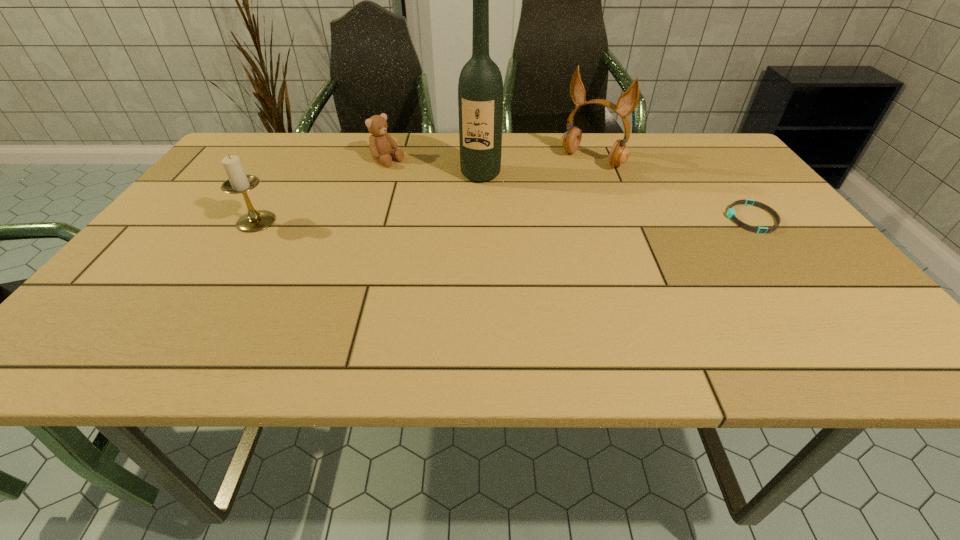
Identify the location of free space on the desktop that is between the candle holder and the wristband and is positioned on the face of the fourth tallest object. The height and width of the screenshot is (540, 960). (497, 220).

Locate an element on the screen. This screenshot has width=960, height=540. free space on the desktop that is between the candle holder and the rightmost object and is positioned on the front-facing side of the fourth shortest object is located at coordinates (528, 220).

This screenshot has height=540, width=960. In order to click on vacant spot on the desktop that is between the candle holder and the wristband and is positioned on the labeled side of the third object from left to right in this screenshot , I will do `click(467, 220)`.